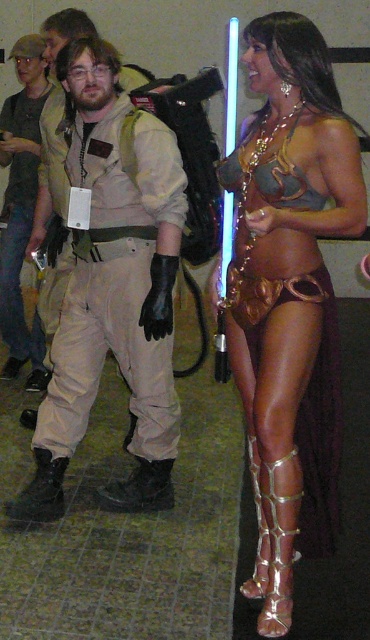
Which is more to the left, metallic gold bikini at center or matte khaki pants at left?

matte khaki pants at left is more to the left.

Which is below, metallic gold bikini at center or matte khaki pants at left?

metallic gold bikini at center

At what (x,y) coordinates should I click in order to perform the action: click on metallic gold bikini at center. Please return your answer as a coordinate pair (x, y). The width and height of the screenshot is (370, 640). Looking at the image, I should click on (290, 298).

Locate an element on the screen. The width and height of the screenshot is (370, 640). metallic gold bikini at center is located at coordinates (290, 298).

Does khaki cotton pants at center have a lesser width compared to matte khaki pants at left?

In fact, khaki cotton pants at center might be wider than matte khaki pants at left.

Who is positioned more to the right, khaki cotton pants at center or matte khaki pants at left?

From the viewer's perspective, khaki cotton pants at center appears more on the right side.

Describe the element at coordinates (113, 292) in the screenshot. I see `khaki cotton pants at center` at that location.

Find the location of a particular element. khaki cotton pants at center is located at coordinates (113, 292).

This screenshot has width=370, height=640. I want to click on metallic gold bikini at center, so click(x=290, y=298).

Is point (227, 328) positioned after point (38, 515)?

No, it is in front of (38, 515).

The image size is (370, 640). I want to click on metallic gold bikini at center, so click(290, 298).